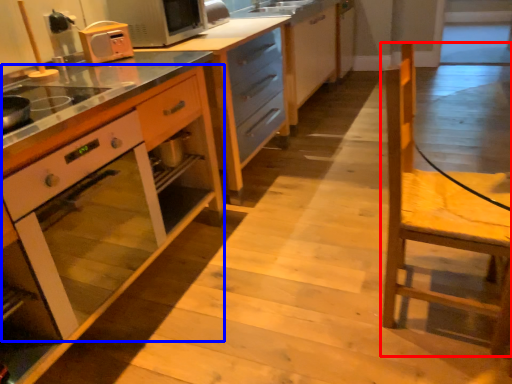
Question: Which of the following is the farthest to the observer, chair (highlighted by a red box) or oven (highlighted by a blue box)?

Choices:
 (A) chair
 (B) oven

Answer: (A)